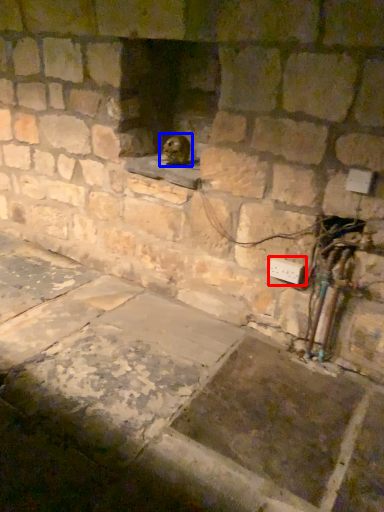
Question: Which object is further to the camera taking this photo, electric outlet (highlighted by a red box) or animal (highlighted by a blue box)?

Choices:
 (A) electric outlet
 (B) animal

Answer: (B)